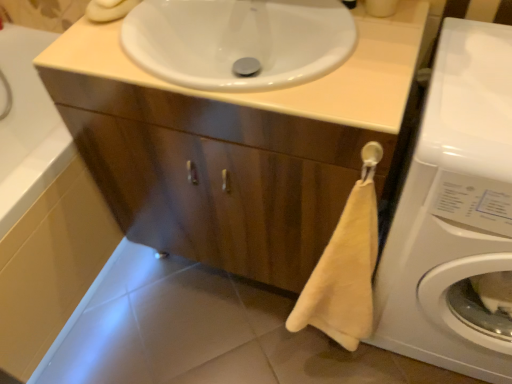
Question: From a real-world perspective, is white glossy sink at upper center on top of white glossy washing machine at lower right?

Choices:
 (A) no
 (B) yes

Answer: (B)

Question: Is white glossy sink at upper center with white glossy washing machine at lower right?

Choices:
 (A) yes
 (B) no

Answer: (B)

Question: Does white glossy sink at upper center come in front of white glossy washing machine at lower right?

Choices:
 (A) yes
 (B) no

Answer: (B)

Question: Does white glossy sink at upper center appear on the right side of white glossy washing machine at lower right?

Choices:
 (A) yes
 (B) no

Answer: (B)

Question: Is white glossy sink at upper center further to camera compared to white glossy washing machine at lower right?

Choices:
 (A) no
 (B) yes

Answer: (B)

Question: From a real-world perspective, is white glossy tile at lower center positioned above or below white glossy bath at lower left?

Choices:
 (A) above
 (B) below

Answer: (B)

Question: Is white glossy tile at lower center situated inside white glossy bath at lower left or outside?

Choices:
 (A) outside
 (B) inside

Answer: (A)

Question: Is point (264, 359) positioned closer to the camera than point (27, 309)?

Choices:
 (A) farther
 (B) closer

Answer: (A)

Question: Looking at the image, does white glossy tile at lower center seem bigger or smaller compared to white glossy bath at lower left?

Choices:
 (A) big
 (B) small

Answer: (B)

Question: Is wooden cabinet at center taller or shorter than white glossy bath at lower left?

Choices:
 (A) short
 (B) tall

Answer: (B)

Question: Is wooden cabinet at center spatially inside white glossy bath at lower left, or outside of it?

Choices:
 (A) inside
 (B) outside

Answer: (B)

Question: Considering the positions of point (116, 137) and point (10, 304), is point (116, 137) closer or farther from the camera than point (10, 304)?

Choices:
 (A) farther
 (B) closer

Answer: (B)

Question: From the image's perspective, is wooden cabinet at center above or below white glossy bath at lower left?

Choices:
 (A) above
 (B) below

Answer: (A)

Question: Is point (508, 33) closer or farther from the camera than point (139, 82)?

Choices:
 (A) closer
 (B) farther

Answer: (B)

Question: In the image, is white glossy washing machine at lower right on the left side or the right side of white glossy sink at upper center?

Choices:
 (A) left
 (B) right

Answer: (B)